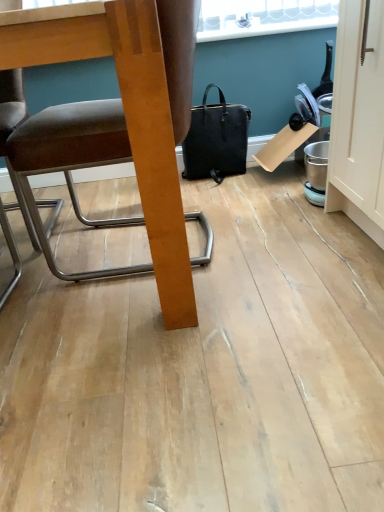
Question: From the image's perspective, is black leather handbag at center located above or below brown leather chair at left?

Choices:
 (A) above
 (B) below

Answer: (A)

Question: In the image, is black leather handbag at center on the left side or the right side of brown leather chair at left?

Choices:
 (A) right
 (B) left

Answer: (A)

Question: Choose the correct answer: Is black leather handbag at center inside brown leather chair at left or outside it?

Choices:
 (A) inside
 (B) outside

Answer: (B)

Question: In the image, is brown leather chair at left positioned in front of or behind black leather handbag at center?

Choices:
 (A) front
 (B) behind

Answer: (A)

Question: Based on their positions, is brown leather chair at left located to the left or right of black leather handbag at center?

Choices:
 (A) right
 (B) left

Answer: (B)

Question: From a real-world perspective, is brown leather chair at left positioned above or below black leather handbag at center?

Choices:
 (A) above
 (B) below

Answer: (A)

Question: From the image's perspective, is brown leather chair at left above or below black leather handbag at center?

Choices:
 (A) above
 (B) below

Answer: (B)